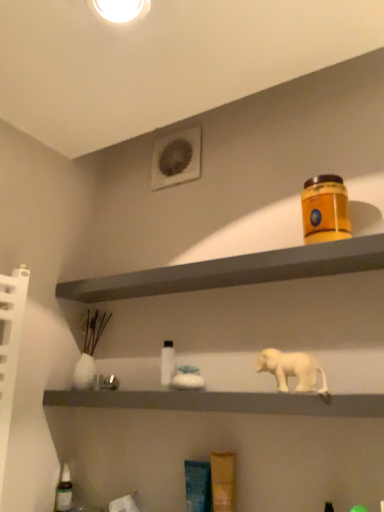
Question: Could you tell me if orange matte jar at upper right is facing white matte elephant at center, the 2th shelf in the top-to-bottom sequence?

Choices:
 (A) yes
 (B) no

Answer: (B)

Question: Is white matte elephant at center, the 2th shelf in the top-to-bottom sequence, completely or partially inside orange matte jar at upper right?

Choices:
 (A) no
 (B) yes

Answer: (A)

Question: From a real-world perspective, is orange matte jar at upper right located beneath white matte elephant at center, the 2th shelf in the top-to-bottom sequence?

Choices:
 (A) no
 (B) yes

Answer: (A)

Question: Are orange matte jar at upper right and white matte elephant at center, placed as the 1th shelf when sorted from bottom to top, far apart?

Choices:
 (A) yes
 (B) no

Answer: (B)

Question: Is orange matte jar at upper right behind white matte elephant at center, placed as the 1th shelf when sorted from bottom to top?

Choices:
 (A) no
 (B) yes

Answer: (B)

Question: Is orange matte jar at upper right looking in the opposite direction of white matte elephant at center, placed as the 1th shelf when sorted from bottom to top?

Choices:
 (A) no
 (B) yes

Answer: (A)

Question: Is white glossy bottle at center, the first bottle in the top-to-bottom sequence, at the right side of white matte elephant at center?

Choices:
 (A) yes
 (B) no

Answer: (B)

Question: Is the depth of white glossy bottle at center, placed as the first bottle when sorted from right to left, greater than that of white matte elephant at center?

Choices:
 (A) no
 (B) yes

Answer: (B)

Question: Does white glossy bottle at center, which is the second bottle from bottom to top, have a lesser width compared to white matte elephant at center?

Choices:
 (A) no
 (B) yes

Answer: (A)

Question: From the image's perspective, is white glossy bottle at center, which is the second bottle from bottom to top, on top of white matte elephant at center?

Choices:
 (A) yes
 (B) no

Answer: (B)

Question: Could white matte elephant at center be considered to be inside white glossy bottle at center, the first bottle in the top-to-bottom sequence?

Choices:
 (A) yes
 (B) no

Answer: (B)

Question: Is white glossy bottle at center, placed as the first bottle when sorted from right to left, facing towards white matte elephant at center?

Choices:
 (A) no
 (B) yes

Answer: (A)

Question: Considering the relative sizes of matte orange container at upper right, the second shelf from the bottom, and white plastic air conditioning unit at upper center in the image provided, is matte orange container at upper right, the second shelf from the bottom, wider than white plastic air conditioning unit at upper center?

Choices:
 (A) no
 (B) yes

Answer: (B)